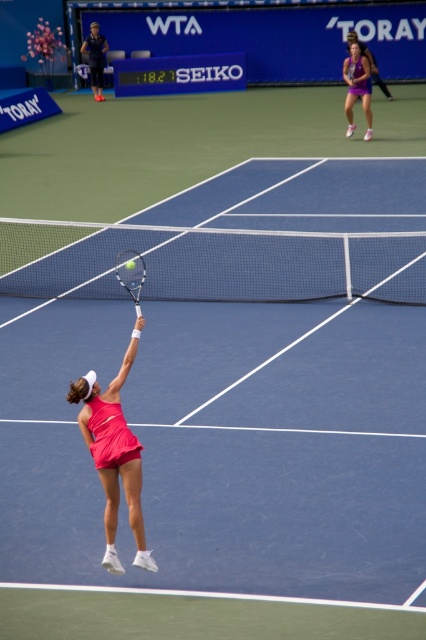
Question: Which object is positioned closest to the purple fabric tennis outfit at upper right?

Choices:
 (A) silver metallic tennis racket at center
 (B) pink fabric tennis outfit at center

Answer: (A)

Question: Based on their relative distances, which object is nearer to the pink fabric tennis outfit at center?

Choices:
 (A) purple fabric tennis outfit at upper right
 (B) silver metallic tennis racket at center

Answer: (B)

Question: Which point is closer to the camera?

Choices:
 (A) (129, 484)
 (B) (368, 88)
 (C) (135, 264)

Answer: (A)

Question: Can you confirm if pink fabric tennis outfit at center is bigger than purple fabric tennis outfit at upper right?

Choices:
 (A) yes
 (B) no

Answer: (B)

Question: Does purple fabric tennis outfit at upper right appear under silver metallic tennis racket at center?

Choices:
 (A) yes
 (B) no

Answer: (B)

Question: Does purple fabric tennis outfit at upper right appear over silver metallic tennis racket at center?

Choices:
 (A) yes
 (B) no

Answer: (A)